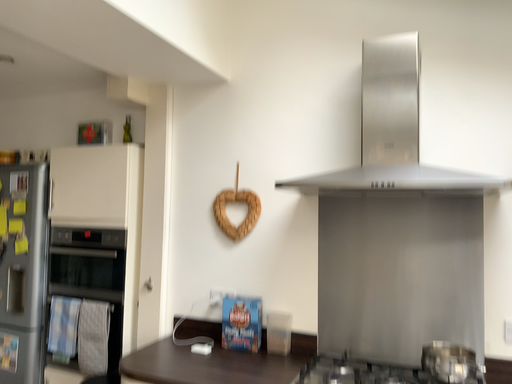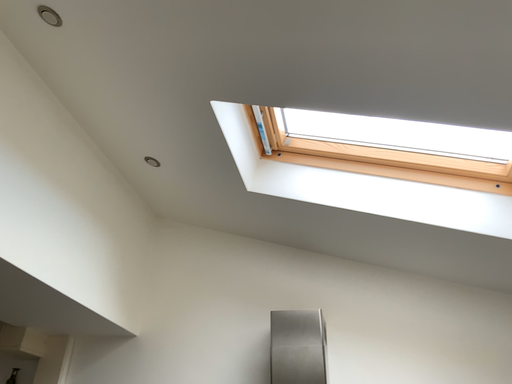
Question: Which way did the camera rotate in the video?

Choices:
 (A) rotated upward
 (B) rotated downward

Answer: (A)